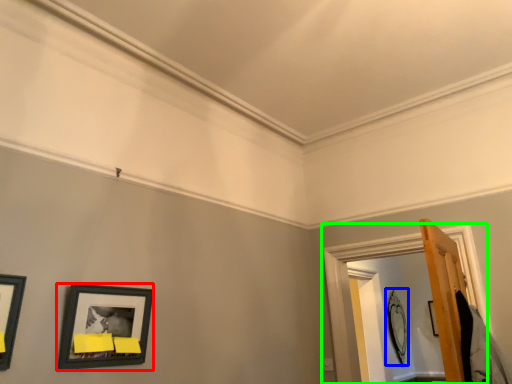
Question: Which object is positioned farthest from picture frame (highlighted by a red box)? Select from picture frame (highlighted by a blue box) and window frame (highlighted by a green box).

Choices:
 (A) picture frame
 (B) window frame

Answer: (A)